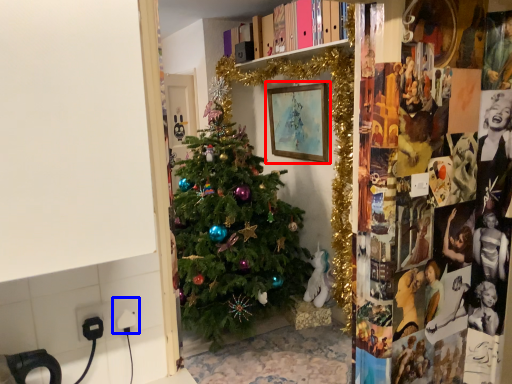
Question: Which object appears farthest to the camera in this image, picture frame (highlighted by a red box) or electric outlet (highlighted by a blue box)?

Choices:
 (A) picture frame
 (B) electric outlet

Answer: (A)